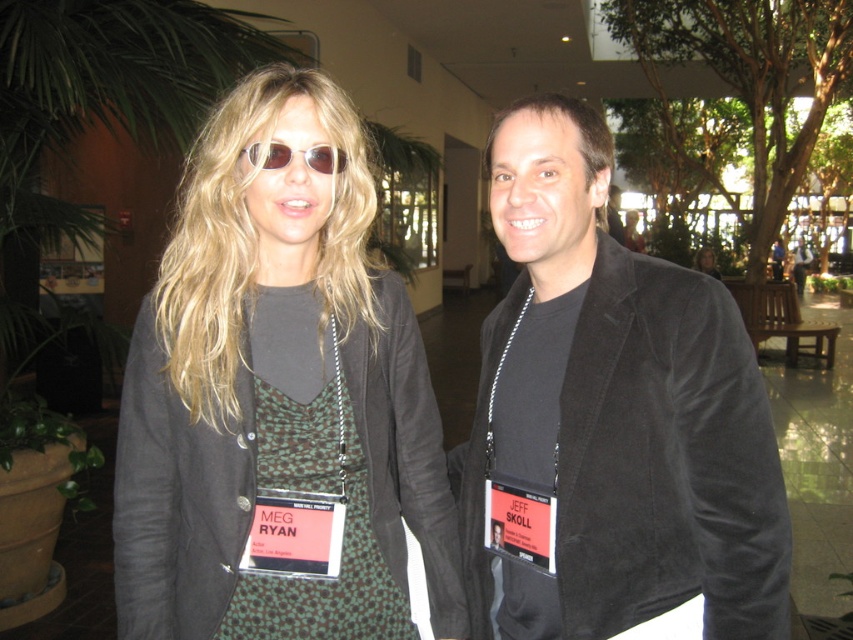
Between point (480, 326) and point (282, 157), which one is positioned in front?

Positioned in front is point (282, 157).

Does suede jacket at center have a smaller size compared to sunglasses at center?

No, suede jacket at center is not smaller than sunglasses at center.

The height and width of the screenshot is (640, 853). I want to click on suede jacket at center, so click(614, 413).

Is green dotted fabric dress at center smaller than matte black blazer at center?

Yes.

Does point (270, 584) come behind point (701, 252)?

No, it is in front of (701, 252).

Measure the distance between point [287,444] and camera.

The distance of point [287,444] from camera is 1.34 meters.

The height and width of the screenshot is (640, 853). What are the coordinates of `green dotted fabric dress at center` in the screenshot? It's located at (312, 490).

Is green dotted fabric dress at center behind sunglasses at center?

→ Yes, green dotted fabric dress at center is behind sunglasses at center.

Is point (271, 308) in front of point (267, 157)?

No, it is behind (267, 157).

Where is `green dotted fabric dress at center`? green dotted fabric dress at center is located at coordinates (312, 490).